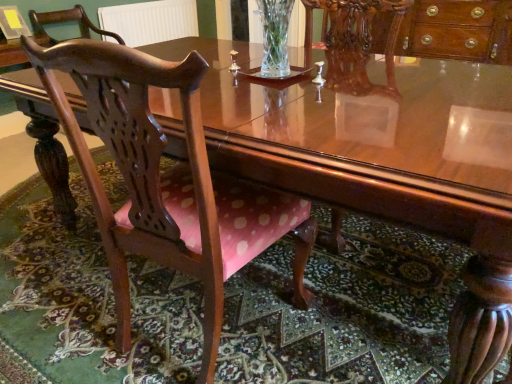
Question: From a real-world perspective, is pink fabric chair at lower left located beneath white textured radiator at upper center?

Choices:
 (A) no
 (B) yes

Answer: (B)

Question: Does pink fabric chair at lower left have a lesser height compared to white textured radiator at upper center?

Choices:
 (A) yes
 (B) no

Answer: (A)

Question: Can you confirm if pink fabric chair at lower left is smaller than white textured radiator at upper center?

Choices:
 (A) no
 (B) yes

Answer: (A)

Question: Is pink fabric chair at lower left further to camera compared to white textured radiator at upper center?

Choices:
 (A) no
 (B) yes

Answer: (A)

Question: Can you confirm if pink fabric chair at lower left is taller than white textured radiator at upper center?

Choices:
 (A) yes
 (B) no

Answer: (B)

Question: Is polished wood chair at left, which ranks as the 2th chair in top-to-bottom order, to the left or to the right of pink fabric chair at lower left in the image?

Choices:
 (A) right
 (B) left

Answer: (A)

Question: Relative to pink fabric chair at lower left, is polished wood chair at left, marked as the 1th chair in a right-to-left arrangement, in front or behind?

Choices:
 (A) behind
 (B) front

Answer: (B)

Question: Is point (256, 187) positioned closer to the camera than point (285, 350)?

Choices:
 (A) closer
 (B) farther

Answer: (A)

Question: From the image's perspective, relative to pink fabric chair at lower left, is polished wood chair at left, placed as the 2th chair when sorted from left to right, above or below?

Choices:
 (A) above
 (B) below

Answer: (A)

Question: Is pink fabric chair at lower left inside the boundaries of polished wood chair at left, which ranks as the 2th chair in back-to-front order, or outside?

Choices:
 (A) outside
 (B) inside

Answer: (A)

Question: Considering their positions, is pink fabric chair at lower left located in front of or behind polished wood chair at left, which ranks as the 2th chair in back-to-front order?

Choices:
 (A) front
 (B) behind

Answer: (B)

Question: Considering the positions of pink fabric chair at lower left and polished wood chair at left, which ranks as the 2th chair in back-to-front order, in the image, is pink fabric chair at lower left wider or thinner than polished wood chair at left, which ranks as the 2th chair in back-to-front order,?

Choices:
 (A) thin
 (B) wide

Answer: (B)

Question: Is point click(x=32, y=220) positioned closer to the camera than point click(x=62, y=66)?

Choices:
 (A) farther
 (B) closer

Answer: (A)

Question: Considering the positions of point (166, 1) and point (25, 332), is point (166, 1) closer or farther from the camera than point (25, 332)?

Choices:
 (A) farther
 (B) closer

Answer: (A)

Question: Is white textured radiator at upper center inside or outside of pink fabric chair at lower left?

Choices:
 (A) outside
 (B) inside

Answer: (A)